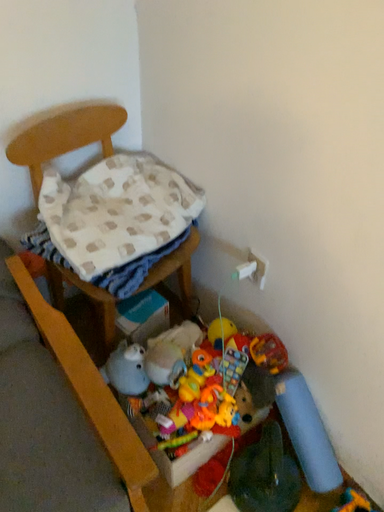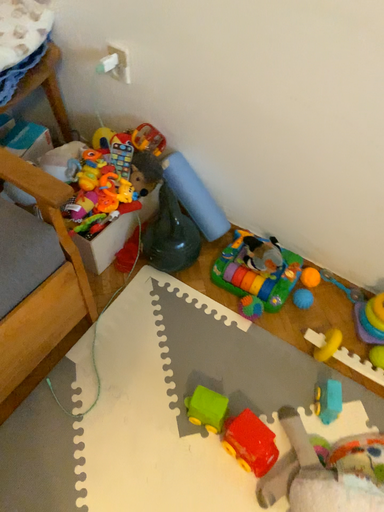
Question: Which way did the camera rotate in the video?

Choices:
 (A) rotated left
 (B) rotated right

Answer: (B)